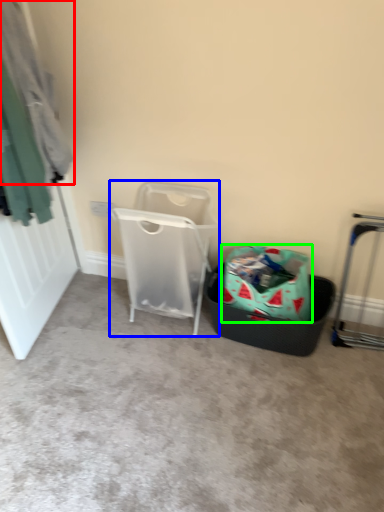
Question: Which object is positioned closest to clothing (highlighted by a red box)? Select from waste container (highlighted by a blue box) and shopping bag (highlighted by a green box).

Choices:
 (A) waste container
 (B) shopping bag

Answer: (A)